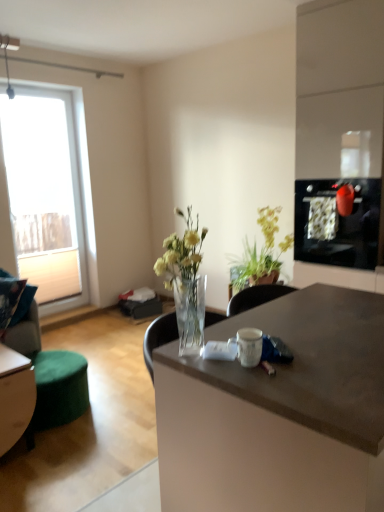
This screenshot has height=512, width=384. In order to click on vacant space to the right of white matte coffee cup at center in this screenshot , I will do `click(308, 349)`.